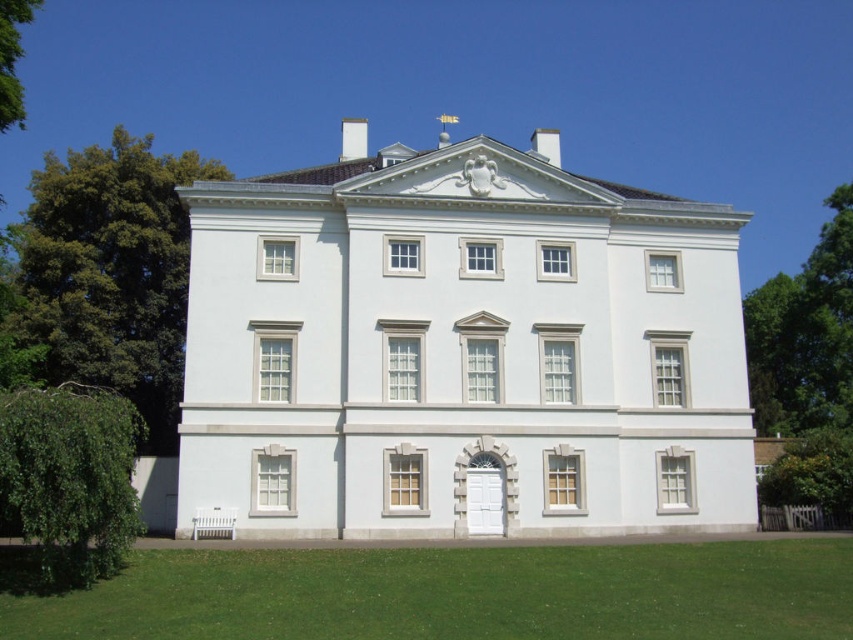
Question: Which object appears closest to the camera in this image?

Choices:
 (A) green leafy tree at upper left
 (B) green leafy tree at left
 (C) green grass at lower center

Answer: (C)

Question: Among these points, which one is farthest from the camera?

Choices:
 (A) (125, 310)
 (B) (641, 435)
 (C) (428, 620)
 (D) (1, 106)

Answer: (A)

Question: Is white smooth building at center bigger than green leafy tree at left?

Choices:
 (A) no
 (B) yes

Answer: (A)

Question: In this image, where is green grass at lower center located relative to green leafy tree at upper left?

Choices:
 (A) above
 (B) below

Answer: (B)

Question: Can you confirm if green leafy tree at left is positioned to the left of green leafy tree at right?

Choices:
 (A) no
 (B) yes

Answer: (B)

Question: Which point appears closest to the camera in this image?

Choices:
 (A) click(120, 467)
 (B) click(148, 624)
 (C) click(761, 312)
 (D) click(3, 77)

Answer: (B)